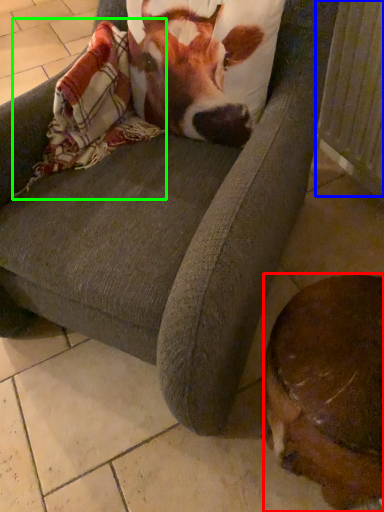
Question: Considering the real-world distances, which object is farthest from dog (highlighted by a red box)? radiator (highlighted by a blue box) or blanket (highlighted by a green box)?

Choices:
 (A) radiator
 (B) blanket

Answer: (A)